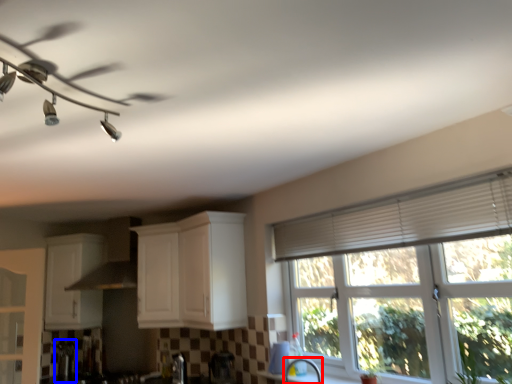
Question: Which of the following is the farthest to the observer, faucet (highlighted by a red box) or appliance (highlighted by a blue box)?

Choices:
 (A) faucet
 (B) appliance

Answer: (B)